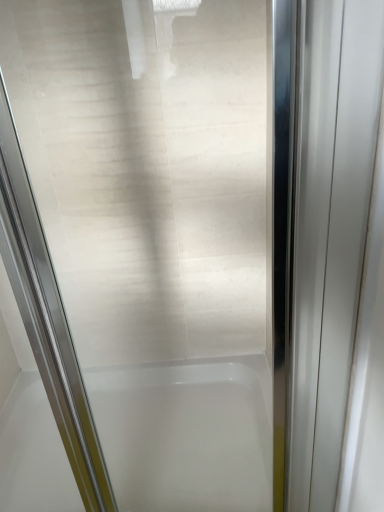
Question: From a real-world perspective, is polished chrome elevator door at right physically located above or below white glossy bathtub at center?

Choices:
 (A) below
 (B) above

Answer: (B)

Question: Is polished chrome elevator door at right taller or shorter than white glossy bathtub at center?

Choices:
 (A) tall
 (B) short

Answer: (A)

Question: Considering the positions of polished chrome elevator door at right and white glossy bathtub at center in the image, is polished chrome elevator door at right wider or thinner than white glossy bathtub at center?

Choices:
 (A) wide
 (B) thin

Answer: (B)

Question: From the image's perspective, relative to polished chrome elevator door at right, is white glossy bathtub at center above or below?

Choices:
 (A) above
 (B) below

Answer: (B)

Question: In terms of width, does white glossy bathtub at center look wider or thinner when compared to polished chrome elevator door at right?

Choices:
 (A) wide
 (B) thin

Answer: (A)

Question: From their relative heights in the image, would you say white glossy bathtub at center is taller or shorter than polished chrome elevator door at right?

Choices:
 (A) short
 (B) tall

Answer: (A)

Question: In the image, is white glossy bathtub at center positioned in front of or behind polished chrome elevator door at right?

Choices:
 (A) front
 (B) behind

Answer: (B)